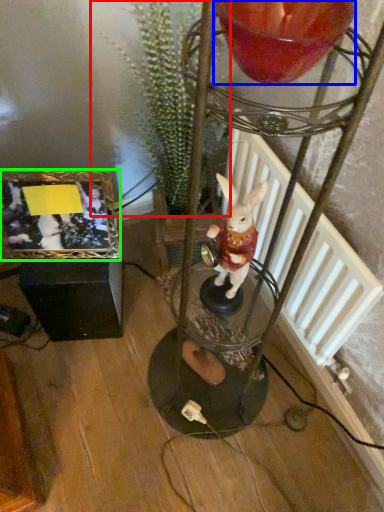
Question: Which is nearer to the plant (highlighted by a red box)? candle holder (highlighted by a blue box) or picture frame (highlighted by a green box).

Choices:
 (A) candle holder
 (B) picture frame

Answer: (B)